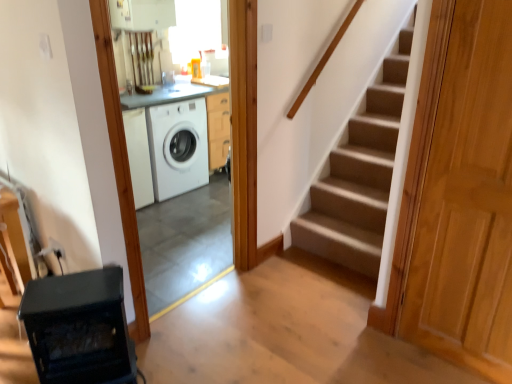
The width and height of the screenshot is (512, 384). Find the location of `unoccupied region to the right of white glossy washing machine at center`. unoccupied region to the right of white glossy washing machine at center is located at coordinates (271, 308).